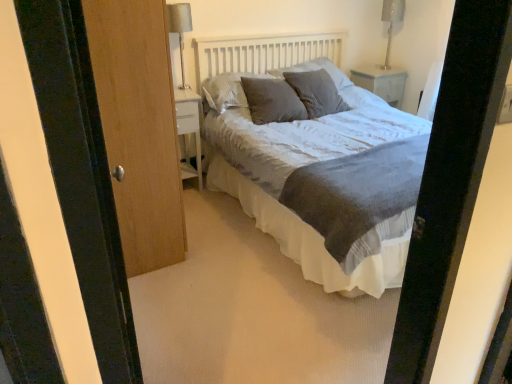
Question: Considering the relative positions of textured gray pillow at center, positioned as the third pillow in right-to-left order, and textured gray bed at center in the image provided, is textured gray pillow at center, positioned as the third pillow in right-to-left order, to the left of textured gray bed at center from the viewer's perspective?

Choices:
 (A) yes
 (B) no

Answer: (A)

Question: Can you confirm if textured gray pillow at center, positioned as the third pillow in right-to-left order, is wider than textured gray bed at center?

Choices:
 (A) no
 (B) yes

Answer: (A)

Question: From the image's perspective, would you say textured gray pillow at center, the 2th pillow positioned from the left, is shown under textured gray bed at center?

Choices:
 (A) yes
 (B) no

Answer: (B)

Question: Is textured gray pillow at center, positioned as the third pillow in right-to-left order, smaller than textured gray bed at center?

Choices:
 (A) yes
 (B) no

Answer: (A)

Question: Is textured gray pillow at center, the 2th pillow positioned from the left, at the right side of textured gray bed at center?

Choices:
 (A) no
 (B) yes

Answer: (A)

Question: Looking at their shapes, would you say metallic silver table lamp at upper right, which appears as the second table lamp when viewed from the front, is wider or thinner than textured gray pillow at center, positioned as the third pillow in right-to-left order?

Choices:
 (A) wide
 (B) thin

Answer: (B)

Question: Is metallic silver table lamp at upper right, placed as the first table lamp when sorted from back to front, bigger or smaller than textured gray pillow at center, the 2th pillow positioned from the left?

Choices:
 (A) big
 (B) small

Answer: (B)

Question: Is point (386, 3) positioned closer to the camera than point (290, 102)?

Choices:
 (A) farther
 (B) closer

Answer: (A)

Question: From the image's perspective, relative to textured gray pillow at center, positioned as the third pillow in right-to-left order, is metallic silver table lamp at upper right, the second table lamp viewed from the left, above or below?

Choices:
 (A) below
 (B) above

Answer: (B)

Question: In terms of width, does textured gray pillow at center, placed as the first pillow when sorted from left to right, look wider or thinner when compared to wooden door at left?

Choices:
 (A) wide
 (B) thin

Answer: (A)

Question: In the image, is textured gray pillow at center, the fourth pillow positioned from the right, positioned in front of or behind wooden door at left?

Choices:
 (A) front
 (B) behind

Answer: (B)

Question: Is textured gray pillow at center, placed as the first pillow when sorted from left to right, inside or outside of wooden door at left?

Choices:
 (A) outside
 (B) inside

Answer: (A)

Question: Does point (218, 94) appear closer or farther from the camera than point (154, 11)?

Choices:
 (A) closer
 (B) farther

Answer: (B)

Question: Is textured gray pillow at center, positioned as the third pillow in right-to-left order, situated inside metallic silver table lamp at upper right, which is the first table lamp in right-to-left order, or outside?

Choices:
 (A) outside
 (B) inside

Answer: (A)

Question: Based on their positions, is textured gray pillow at center, the 2th pillow positioned from the left, located to the left or right of metallic silver table lamp at upper right, which appears as the second table lamp when viewed from the front?

Choices:
 (A) left
 (B) right

Answer: (A)